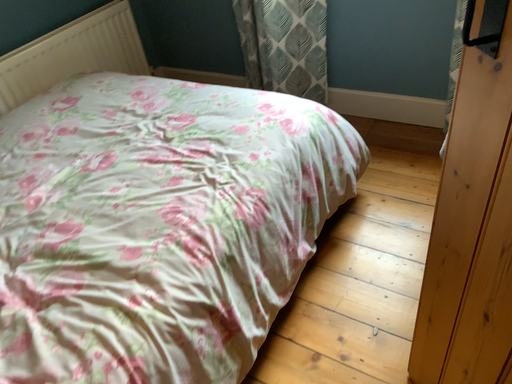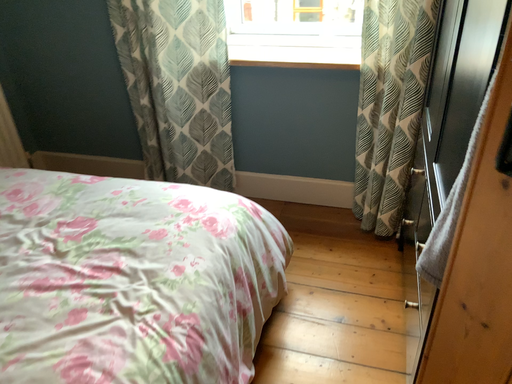
Question: How did the camera likely rotate when shooting the video?

Choices:
 (A) rotated right
 (B) rotated left

Answer: (A)